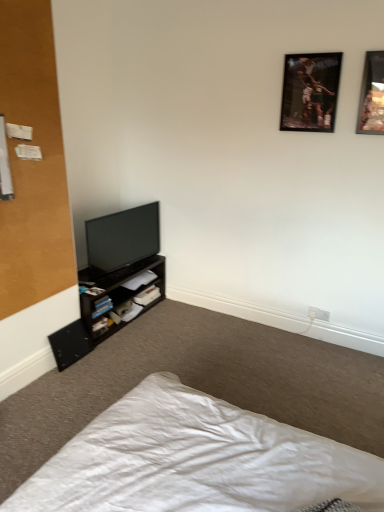
Where is `free space above matte black tv at lower left (from a real-world perspective)`? free space above matte black tv at lower left (from a real-world perspective) is located at coordinates (121, 217).